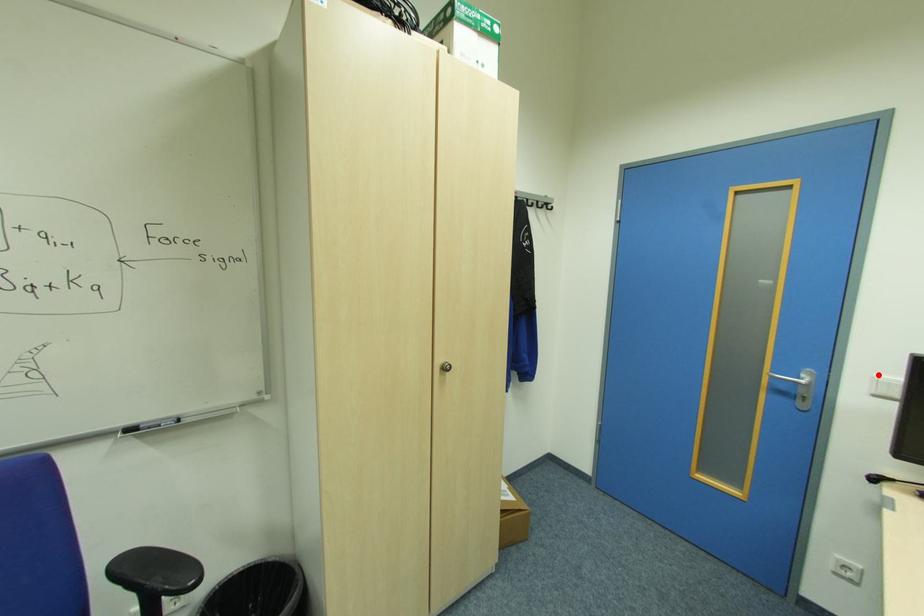
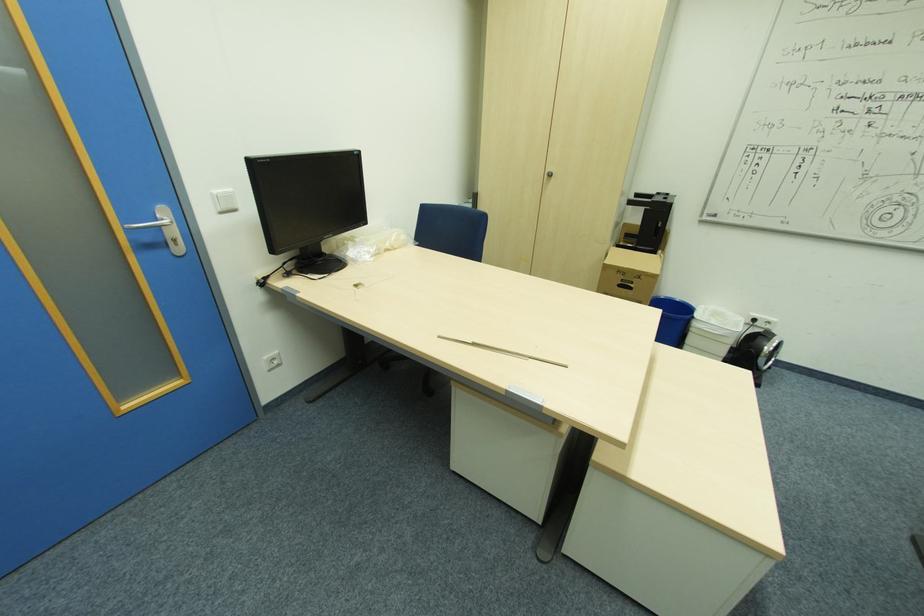
Question: I am providing you with two images of the same scene from different viewpoints. Given a red point in image1, look at the same physical point in image2. Is it:

Choices:
 (A) Closer to the viewpoint
 (B) Farther from the viewpoint

Answer: (A)